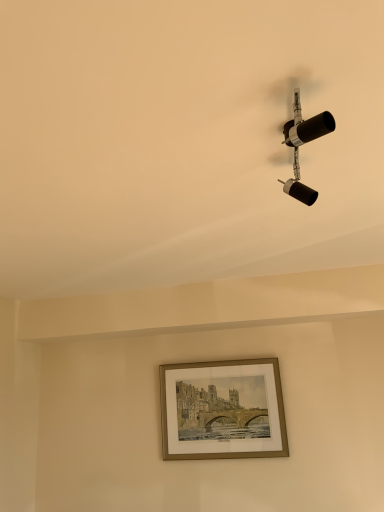
Question: Could you tell me if gold metallic picture frame at center is facing matte black spotlight at upper right?

Choices:
 (A) yes
 (B) no

Answer: (A)

Question: Is gold metallic picture frame at center located outside matte black spotlight at upper right?

Choices:
 (A) no
 (B) yes

Answer: (B)

Question: Considering the relative sizes of gold metallic picture frame at center and matte black spotlight at upper right in the image provided, is gold metallic picture frame at center shorter than matte black spotlight at upper right?

Choices:
 (A) yes
 (B) no

Answer: (B)

Question: From the image's perspective, is gold metallic picture frame at center over matte black spotlight at upper right?

Choices:
 (A) no
 (B) yes

Answer: (A)

Question: From the image's perspective, is gold metallic picture frame at center below matte black spotlight at upper right?

Choices:
 (A) yes
 (B) no

Answer: (A)

Question: Is gold metallic picture frame at center to the left of matte black spotlight at upper right from the viewer's perspective?

Choices:
 (A) yes
 (B) no

Answer: (A)

Question: Is matte black spotlight at upper right bigger than gold metallic picture frame at center?

Choices:
 (A) no
 (B) yes

Answer: (A)

Question: Can you confirm if matte black spotlight at upper right is taller than gold metallic picture frame at center?

Choices:
 (A) no
 (B) yes

Answer: (A)

Question: Does matte black spotlight at upper right come behind gold metallic picture frame at center?

Choices:
 (A) no
 (B) yes

Answer: (A)

Question: Does matte black spotlight at upper right have a lesser height compared to gold metallic picture frame at center?

Choices:
 (A) yes
 (B) no

Answer: (A)

Question: Would you say matte black spotlight at upper right is outside gold metallic picture frame at center?

Choices:
 (A) yes
 (B) no

Answer: (A)

Question: From a real-world perspective, is matte black spotlight at upper right under gold metallic picture frame at center?

Choices:
 (A) no
 (B) yes

Answer: (A)

Question: Would you say matte black spotlight at upper right is inside or outside gold metallic picture frame at center?

Choices:
 (A) outside
 (B) inside

Answer: (A)